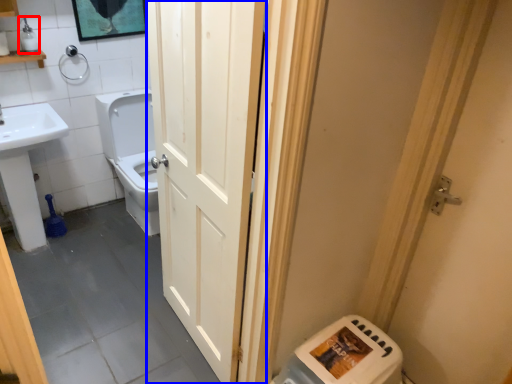
Question: Which point is closer to the camera, toiletry (highlighted by a red box) or door (highlighted by a blue box)?

Choices:
 (A) toiletry
 (B) door

Answer: (B)